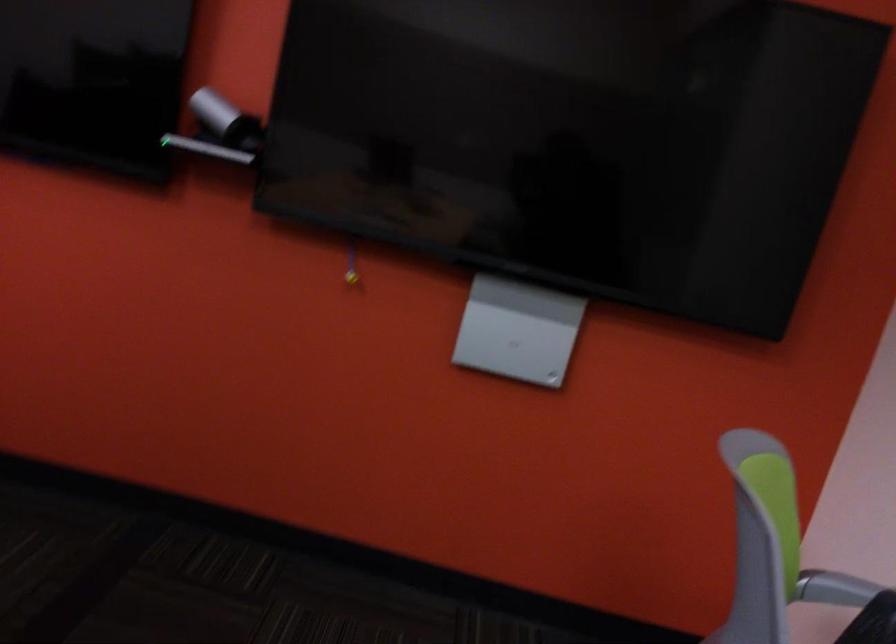
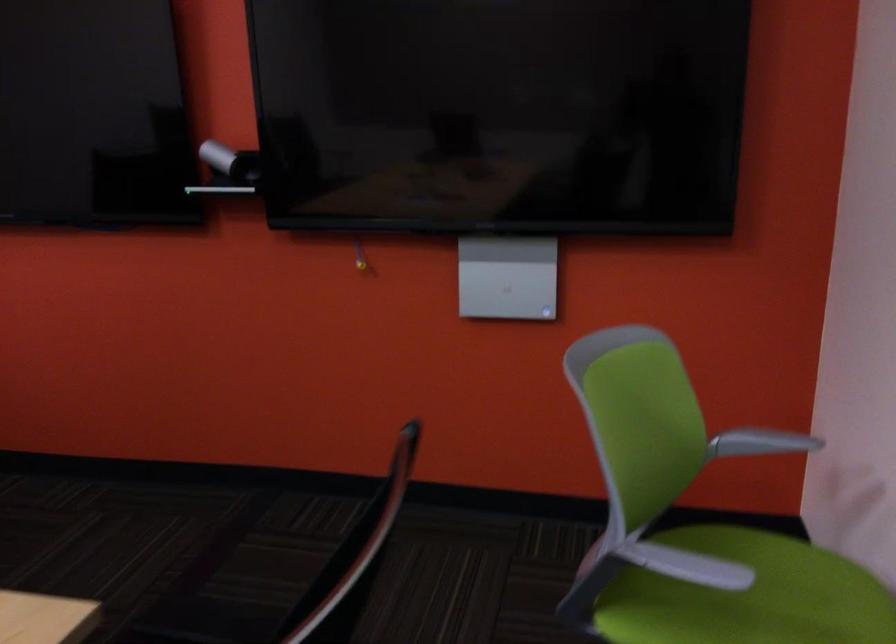
In the second image, find the point that corresponds to (229,115) in the first image.

(230, 162)